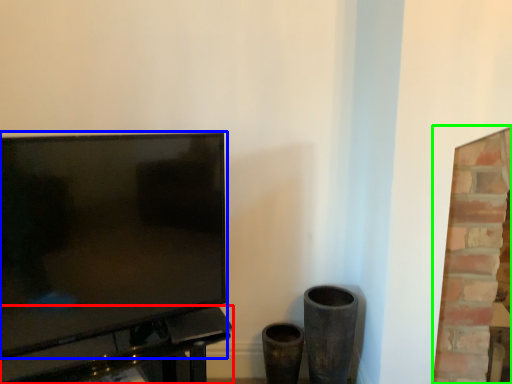
Question: Based on their relative distances, which object is nearer to table (highlighted by a red box)? Choose from television (highlighted by a blue box) and fireplace (highlighted by a green box).

Choices:
 (A) television
 (B) fireplace

Answer: (A)